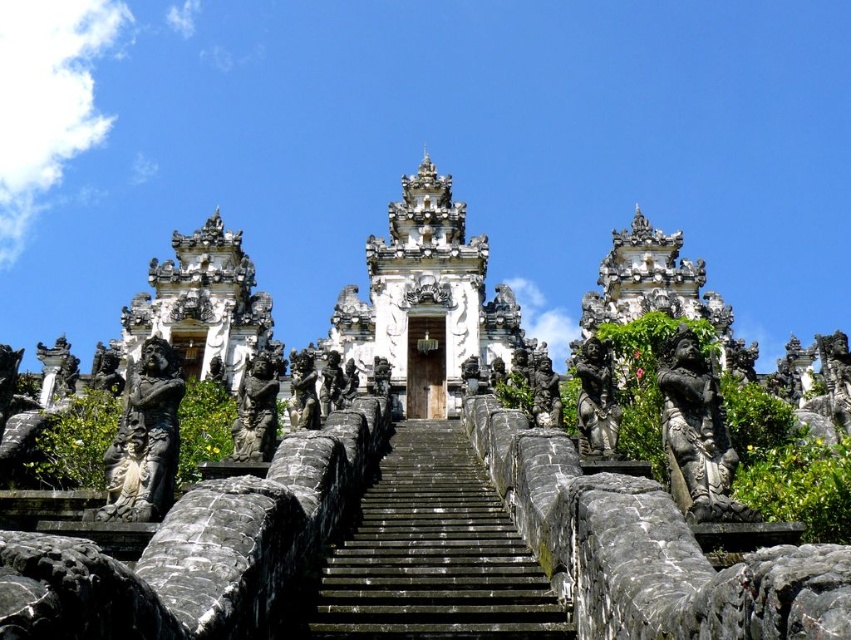
You are a tourist standing at the bottom of the black stone stairs at center and want to enter the white stone temple at center. Which direction should you move to reach the temple?

The black stone stairs at center is located below the white stone temple at center, so you should move upward along the black stone stairs at center to reach the temple.

You are standing at the entrance of the temple and want to reach the topmost tier. Which direction should you move relative to the black stone stairs at center?

To reach the topmost tier of the temple, you should move upward along the black stone stairs at center since they are centrally located and lead towards the upper structure.